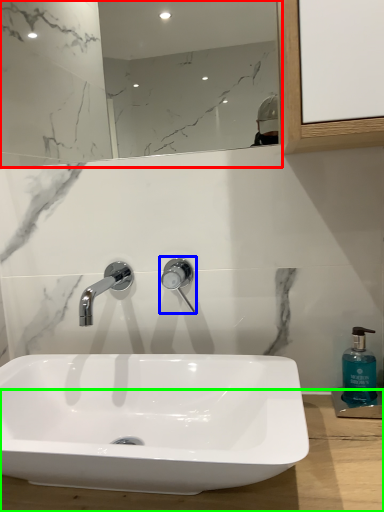
Question: Which object is positioned closest to mirror (highlighted by a red box)? Select from tap (highlighted by a blue box) and counter top (highlighted by a green box).

Choices:
 (A) tap
 (B) counter top

Answer: (A)